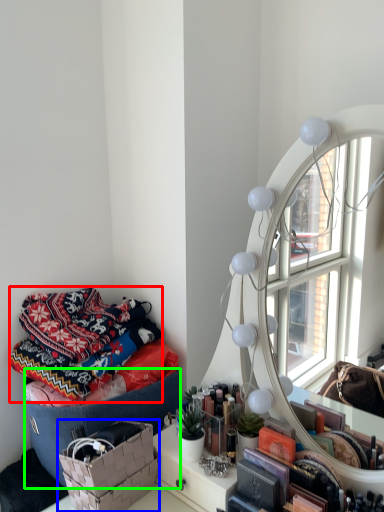
Question: Considering the real-world distances, which object is farthest from blanket (highlighted by a red box)? basket (highlighted by a blue box) or storage box (highlighted by a green box)?

Choices:
 (A) basket
 (B) storage box

Answer: (A)